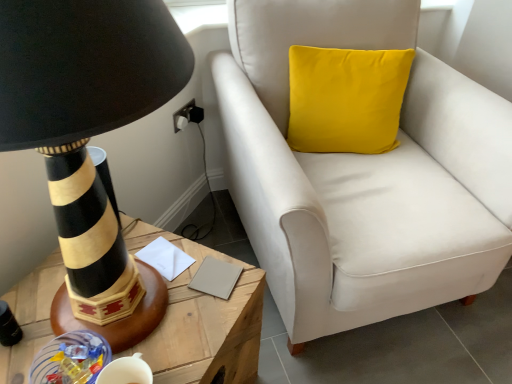
Find the location of a particular element. This screenshot has width=512, height=384. free space to the left of beige matte notepad at center, which is the 2th notepad in left-to-right order is located at coordinates (168, 274).